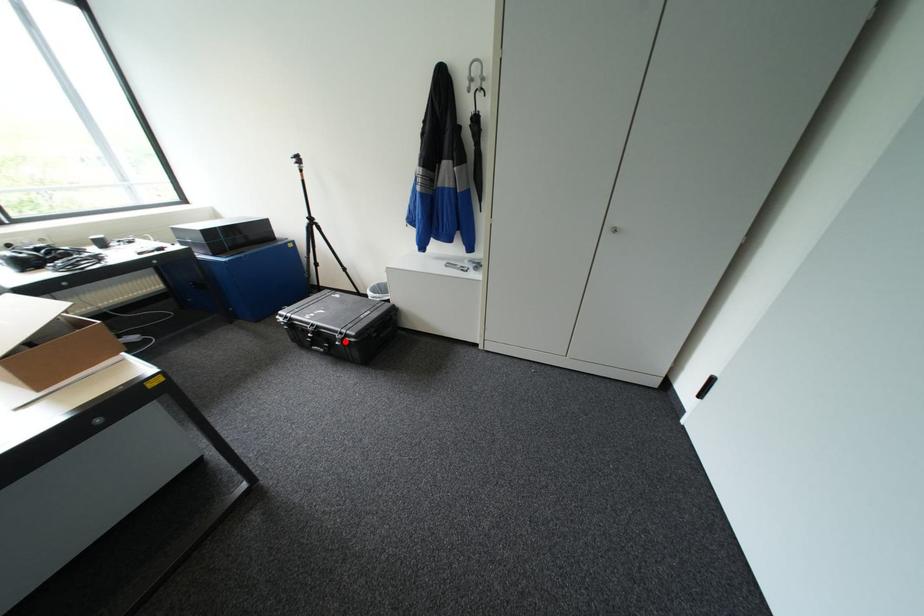
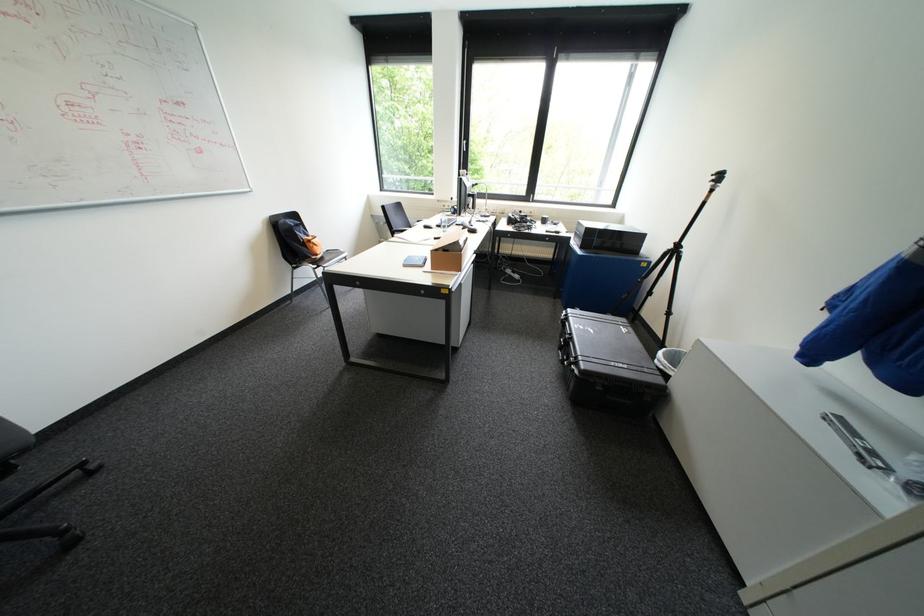
Find the pixel in the second image that matches the highlighted location in the first image.

(574, 361)